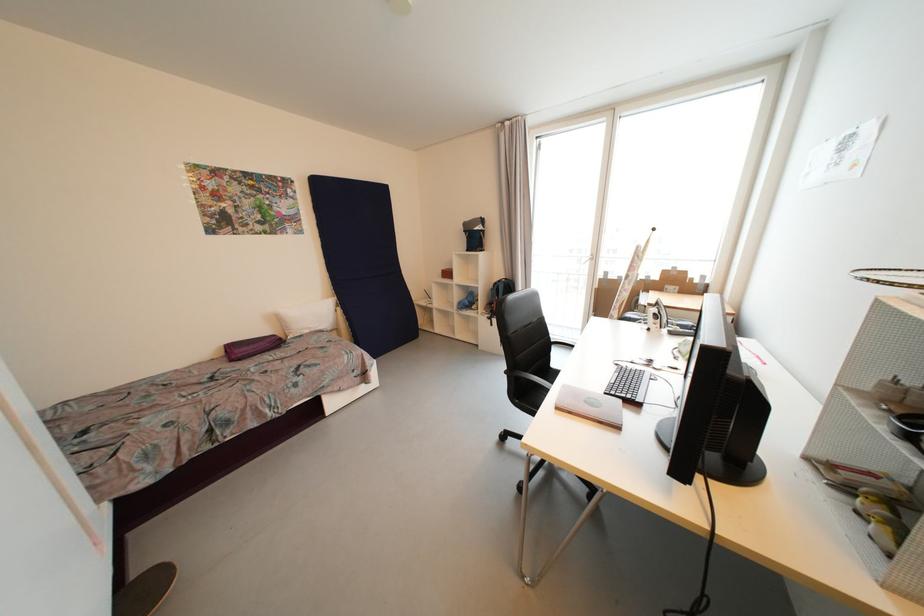
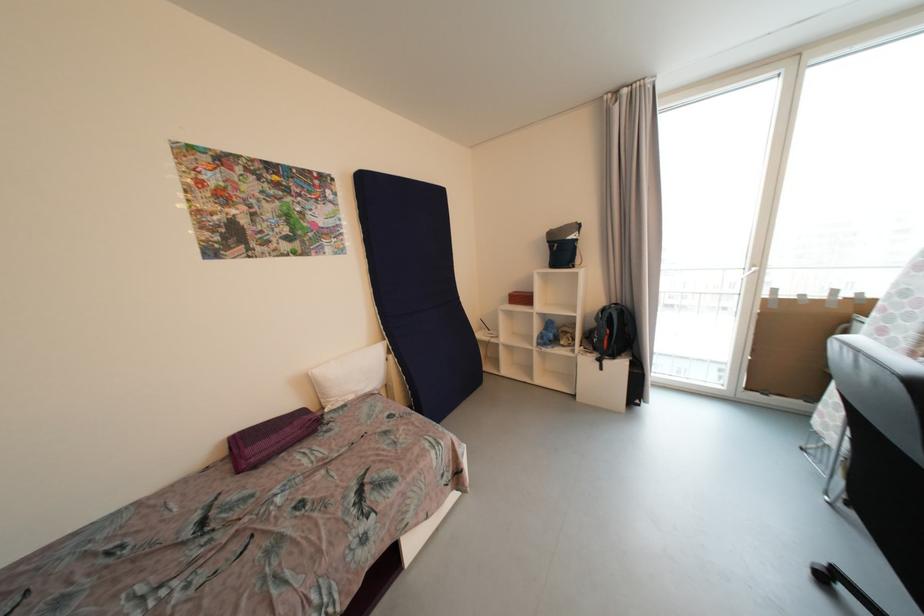
Where in the second image is the point corresponding to [283,321] from the first image?

(315, 386)